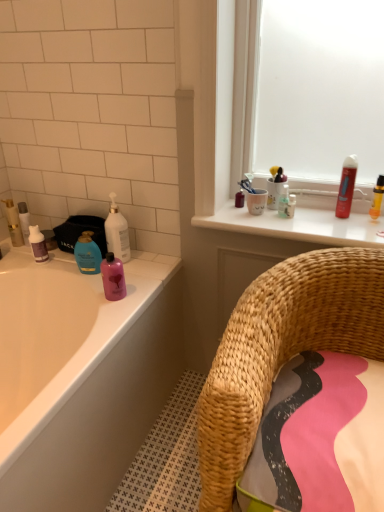
You are a GUI agent. You are given a task and a screenshot of the screen. Output one action in this format:
    pyautogui.click(x=<x>, y=<y>)
    Task: Click on the vacant space in front of translucent yellow bottle at upper right, the 6th toiletry viewed from the left
    This screenshot has width=384, height=512.
    Given the screenshot: What is the action you would take?
    pyautogui.click(x=367, y=234)